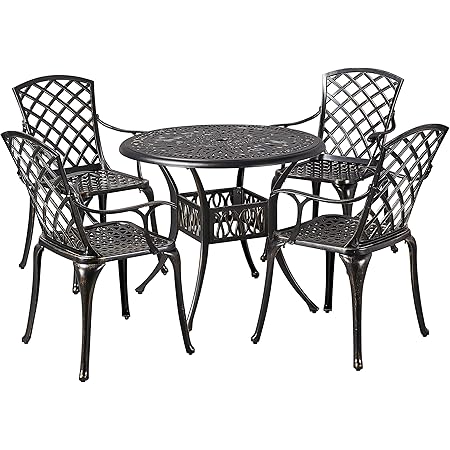
In order to click on chair arms in this screenshot , I will do `click(307, 197)`, `click(377, 137)`, `click(297, 121)`, `click(110, 126)`, `click(149, 207)`.